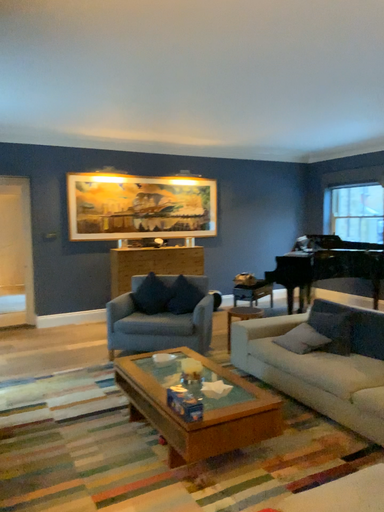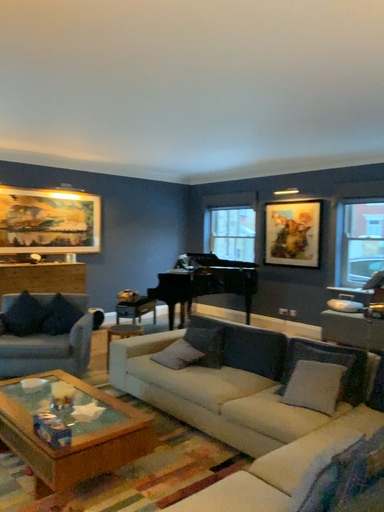
Question: Which way did the camera rotate in the video?

Choices:
 (A) rotated right
 (B) rotated left

Answer: (A)